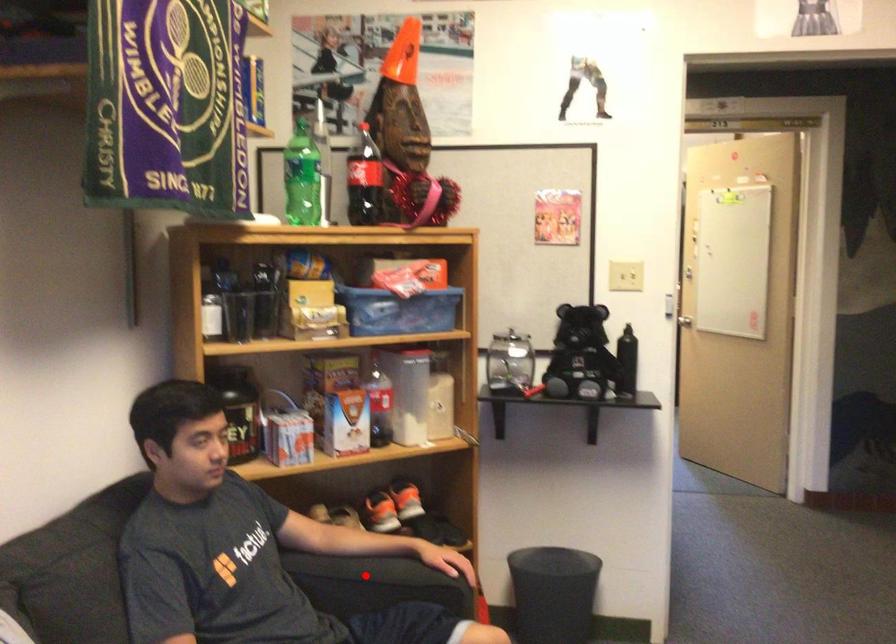
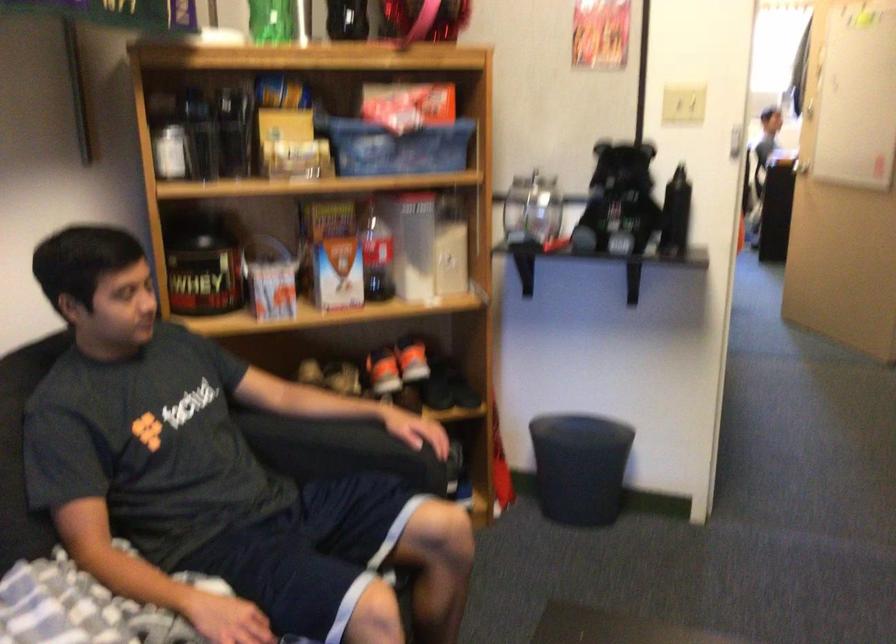
Question: I am providing you with two images of the same scene from different viewpoints. In image1, a red point is highlighted. Considering the same 3D point in image2, which of the following is correct?

Choices:
 (A) It is closer
 (B) It is farther

Answer: (A)